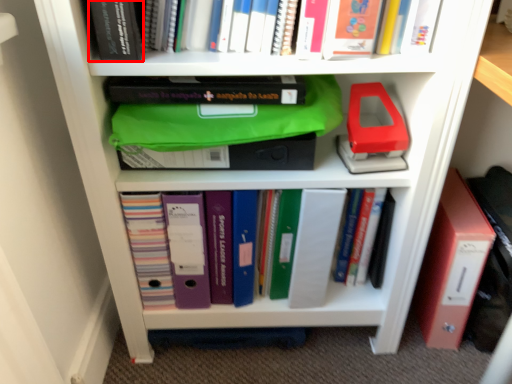
Question: Observing the image, what is the correct spatial positioning of book (annotated by the red box) in reference to book?

Choices:
 (A) left
 (B) right

Answer: (A)